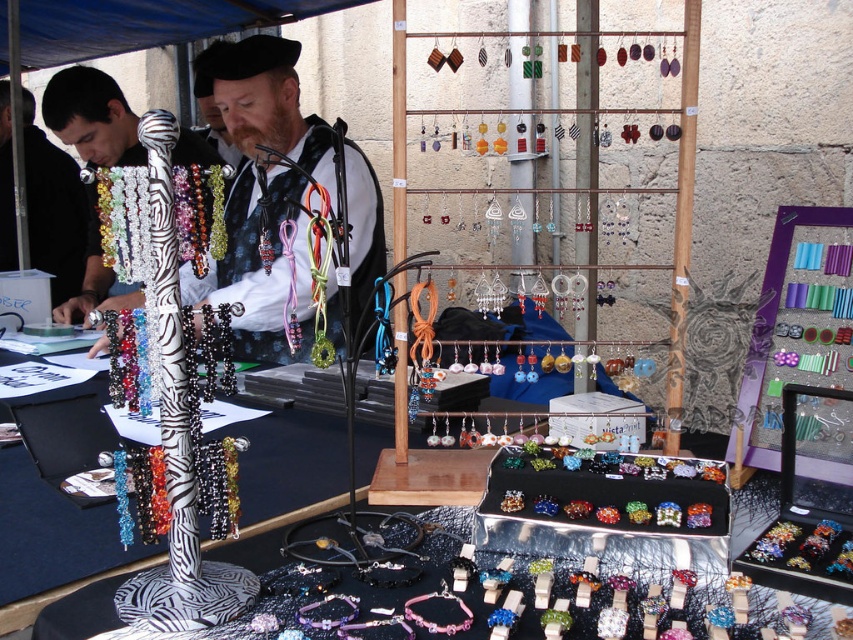
Question: Observing the image, what is the correct spatial positioning of matte black vest at center in reference to zebra-patterned necklace at left?

Choices:
 (A) above
 (B) below

Answer: (B)

Question: Which object is positioned closest to the zebra-patterned necklace at left?

Choices:
 (A) multicolored beaded bracelet at center
 (B) matte black vest at center
 (C) matte black shirt at left

Answer: (B)

Question: Does matte black vest at center have a greater width compared to zebra-patterned necklace at left?

Choices:
 (A) no
 (B) yes

Answer: (A)

Question: Which object appears closest to the camera in this image?

Choices:
 (A) multicolored beaded bracelet at center
 (B) matte black vest at center
 (C) matte black shirt at left
 (D) zebra-patterned necklace at left

Answer: (A)

Question: Which object is farther from the camera taking this photo?

Choices:
 (A) matte black vest at center
 (B) matte black shirt at left
 (C) multicolored beaded bracelet at center
 (D) zebra-patterned necklace at left

Answer: (B)

Question: Is matte black vest at center in front of zebra-patterned necklace at left?

Choices:
 (A) yes
 (B) no

Answer: (A)